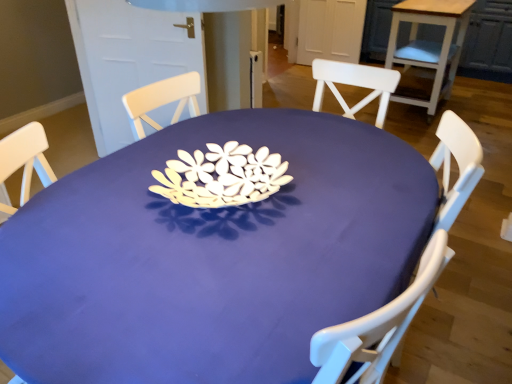
Question: Is point (250, 261) positioned closer to the camera than point (467, 18)?

Choices:
 (A) farther
 (B) closer

Answer: (B)

Question: Considering the positions of matte purple table at center, the 1th table viewed from the front, and wooden table at upper right, placed as the 1th table when sorted from right to left, in the image, is matte purple table at center, the 1th table viewed from the front, taller or shorter than wooden table at upper right, placed as the 1th table when sorted from right to left,?

Choices:
 (A) short
 (B) tall

Answer: (A)

Question: From the image's perspective, is matte purple table at center, which is the 2th table from top to bottom, positioned above or below wooden table at upper right, which is the 2th table in bottom-to-top order?

Choices:
 (A) below
 (B) above

Answer: (A)

Question: From their relative heights in the image, would you say wooden table at upper right, arranged as the 2th table when viewed from the left, is taller or shorter than matte purple table at center, the 2th table when ordered from right to left?

Choices:
 (A) short
 (B) tall

Answer: (B)

Question: In terms of width, does wooden table at upper right, which is counted as the first table, starting from the back, look wider or thinner when compared to matte purple table at center, the 2th table when ordered from right to left?

Choices:
 (A) wide
 (B) thin

Answer: (B)

Question: In the image, is wooden table at upper right, which is the 2th table in bottom-to-top order, on the left side or the right side of matte purple table at center, acting as the 1th table starting from the left?

Choices:
 (A) right
 (B) left

Answer: (A)

Question: Is point (449, 51) positioned closer to the camera than point (50, 206)?

Choices:
 (A) closer
 (B) farther

Answer: (B)